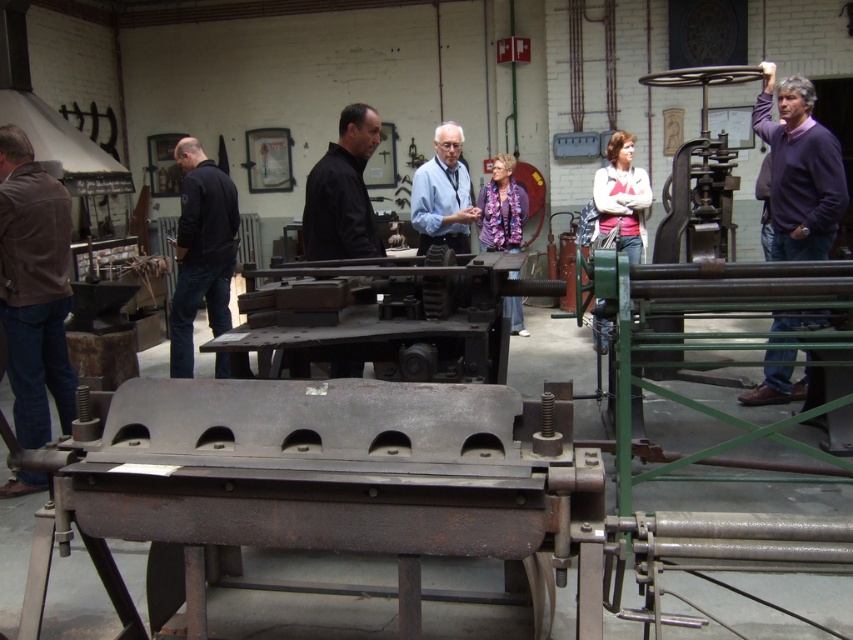
Question: Is purple sweater at right to the right of purple floral shirt at center from the viewer's perspective?

Choices:
 (A) no
 (B) yes

Answer: (B)

Question: Among these objects, which one is farthest from the camera?

Choices:
 (A) light blue shirt at center
 (B) brown leather jacket at left
 (C) purple sweater at right

Answer: (A)

Question: Which point appears farthest from the camera in this image?

Choices:
 (A) (503, 378)
 (B) (492, 198)

Answer: (B)

Question: Is the position of brown leather jacket at left more distant than that of black matte jacket at left?

Choices:
 (A) yes
 (B) no

Answer: (B)

Question: Which point appears farthest from the camera in this image?

Choices:
 (A) coord(234,256)
 (B) coord(56,403)

Answer: (A)

Question: Can you confirm if rusty metal machinery at center is smaller than matte white sweater at center?

Choices:
 (A) yes
 (B) no

Answer: (B)